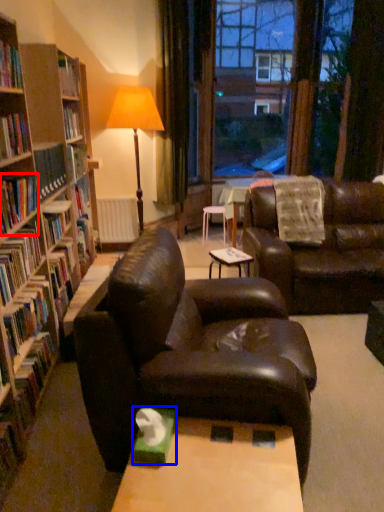
Question: Among these objects, which one is nearest to the camera, book (highlighted by a red box) or paperback book (highlighted by a blue box)?

Choices:
 (A) book
 (B) paperback book

Answer: (B)